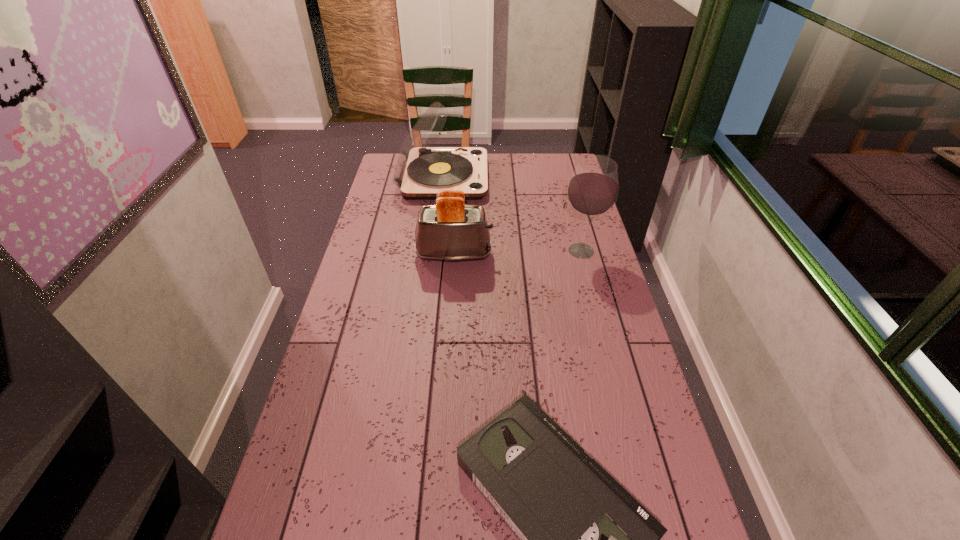
In the image, there is a desktop. Identify the location of vacant area at the far edge. (524, 172).

Find the location of `blank space at the left edge of the desktop`. blank space at the left edge of the desktop is located at coordinates (383, 229).

At what (x,y) coordinates should I click in order to perform the action: click on free space at the right edge of the desktop. Please return your answer as a coordinate pair (x, y). The width and height of the screenshot is (960, 540). Looking at the image, I should click on (615, 368).

Image resolution: width=960 pixels, height=540 pixels. In the image, there is a desktop. What are the coordinates of `free space at the far left corner` in the screenshot? It's located at (391, 163).

I want to click on vacant space at the far right corner of the desktop, so click(554, 160).

Where is `vacant space in between the alcohol and the record player`? This screenshot has width=960, height=540. vacant space in between the alcohol and the record player is located at coordinates (512, 214).

Identify the location of vacant space in between the second shortest object and the alcohol. This screenshot has width=960, height=540. (517, 253).

Find the location of a particular element. Image resolution: width=960 pixels, height=540 pixels. unoccupied area between the alcohol and the farthest object is located at coordinates (512, 214).

Locate an element on the screen. This screenshot has height=540, width=960. vacant region between the toaster and the alcohol is located at coordinates (517, 253).

Find the location of a particular element. This screenshot has width=960, height=540. object identified as the closest to the third tallest object is located at coordinates (593, 189).